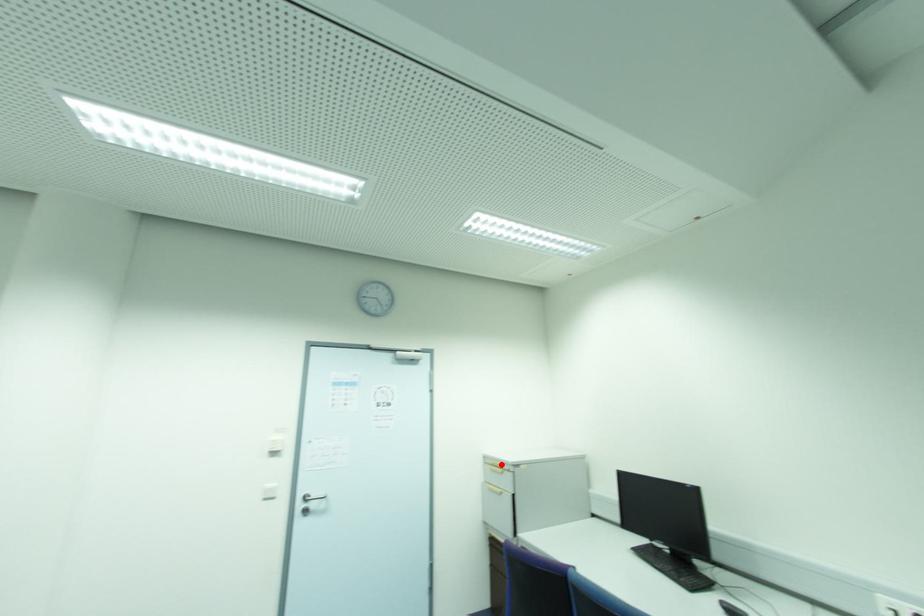
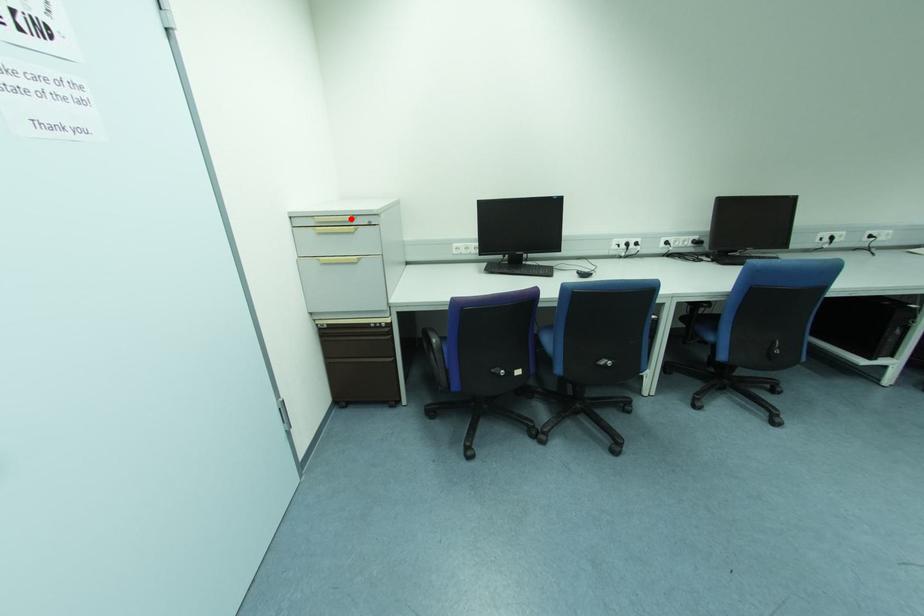
I am providing you with two images of the same scene from different viewpoints. A red point is marked on the first image and another point is marked on the second image. Is the red point in image1 aligned with the point shown in image2?

Yes